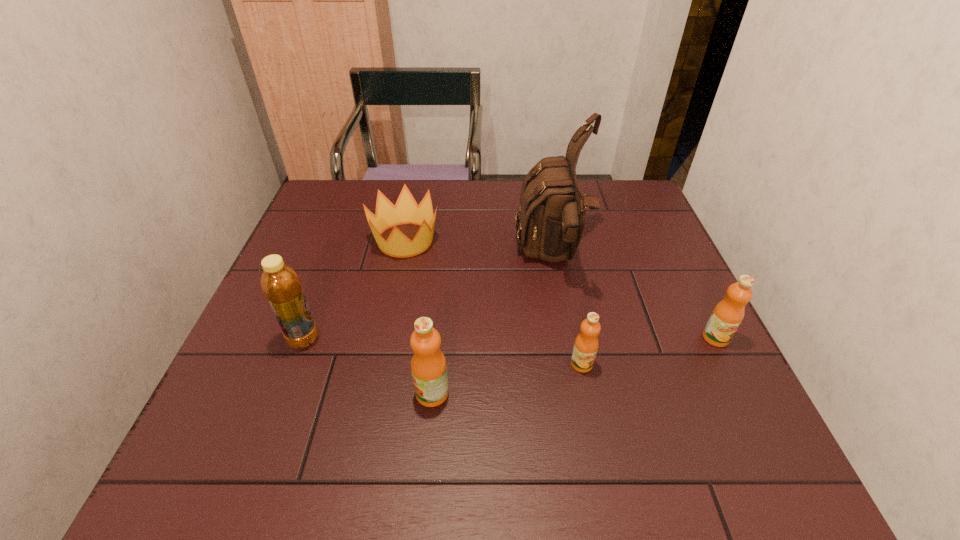
At what (x,y) coordinates should I click in order to perform the action: click on blank area located on the front label of the nearest object. Please return your answer as a coordinate pair (x, y). The width and height of the screenshot is (960, 540). Looking at the image, I should click on (375, 393).

At what (x,y) coordinates should I click in order to perform the action: click on free point located on the front label of the nearest object. Please return your answer as a coordinate pair (x, y). Looking at the image, I should click on 381,393.

You are a GUI agent. You are given a task and a screenshot of the screen. Output one action in this format:
    pyautogui.click(x=<x>, y=<y>)
    Task: Click on the free region located 0.110m on the front label of the shortest orange juice
    
    Given the screenshot: What is the action you would take?
    pyautogui.click(x=593, y=422)

This screenshot has width=960, height=540. Find the location of `free space located on the front label of the second shortest orange juice`. free space located on the front label of the second shortest orange juice is located at coordinates (744, 396).

What are the coordinates of `vacant space located 0.060m on the left of the shortest object` in the screenshot? It's located at (349, 240).

Where is `free space located on the front-facing side of the tallest object`? free space located on the front-facing side of the tallest object is located at coordinates (442, 258).

Identify the location of vacant space located on the front-facing side of the tallest object. (427, 258).

Identify the location of vacant region located 0.290m on the front-facing side of the tallest object. This screenshot has width=960, height=540. (408, 258).

Locate an element on the screen. This screenshot has width=960, height=540. free space located 0.110m on the back of the bottle is located at coordinates (321, 293).

The width and height of the screenshot is (960, 540). Identify the location of object that is at the far edge. point(406,211).